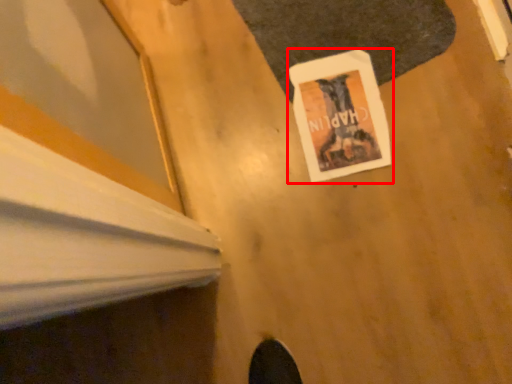
Question: From the image, what is the correct spatial relationship of poster page (annotated by the red box) in relation to mat?

Choices:
 (A) right
 (B) left

Answer: (B)